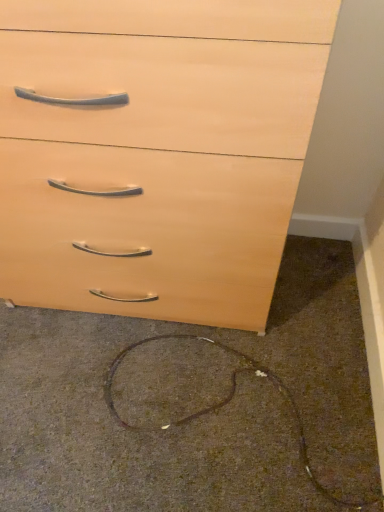
The image size is (384, 512). I want to click on vacant space situated above brown matte wire at lower center (from a real-world perspective), so click(201, 379).